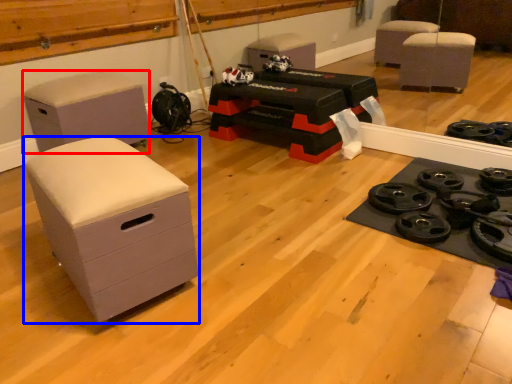
Question: Which point is closer to the camera, furniture (highlighted by a red box) or chest of drawers (highlighted by a blue box)?

Choices:
 (A) furniture
 (B) chest of drawers

Answer: (B)